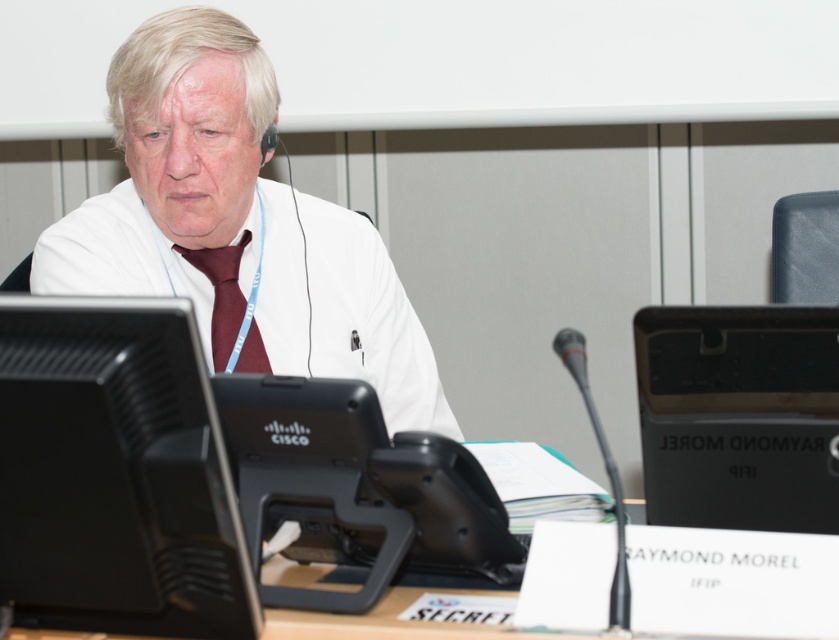
How distant is black glossy monitor at left from burgundy satin tie at center?

black glossy monitor at left and burgundy satin tie at center are 27.03 inches apart from each other.

In order to click on black glossy monitor at left in this screenshot , I will do `click(115, 474)`.

Is point (77, 454) more distant than point (230, 266)?

That is False.

Find the location of a particular element. black glossy monitor at left is located at coordinates (115, 474).

Is point (201, 332) positioned behind point (189, 360)?

Yes.

Where is `white matte lab coat at center`? This screenshot has width=839, height=640. white matte lab coat at center is located at coordinates (237, 227).

Identify the location of white matte lab coat at center. (237, 227).

Is point (319, 301) positioned behind point (832, 330)?

Yes, point (319, 301) is farther from viewer.

Measure the distance between point (337, 340) and camera.

5.48 feet

Between point (63, 266) and point (803, 509), which one is positioned behind?

Positioned behind is point (63, 266).

Where is `white matte lab coat at center`? Image resolution: width=839 pixels, height=640 pixels. white matte lab coat at center is located at coordinates (237, 227).